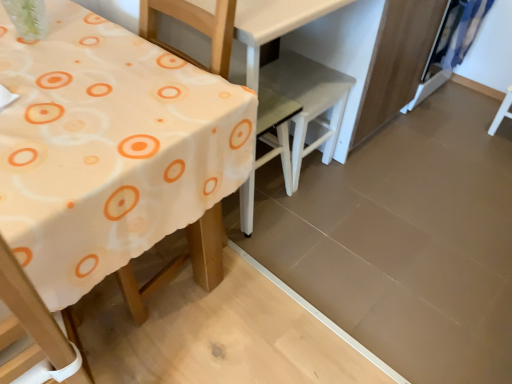
Where is `empty space that is ontop of white plastic chair at center, the second chair when ordered from left to right (from a real-world perspective)`? This screenshot has height=384, width=512. empty space that is ontop of white plastic chair at center, the second chair when ordered from left to right (from a real-world perspective) is located at coordinates (309, 84).